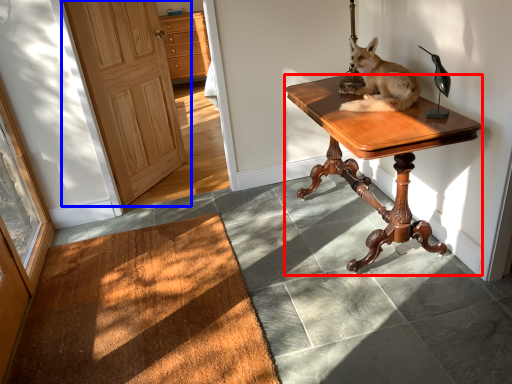
Question: Which object appears closest to the camera in this image, desk (highlighted by a red box) or door (highlighted by a blue box)?

Choices:
 (A) desk
 (B) door

Answer: (A)